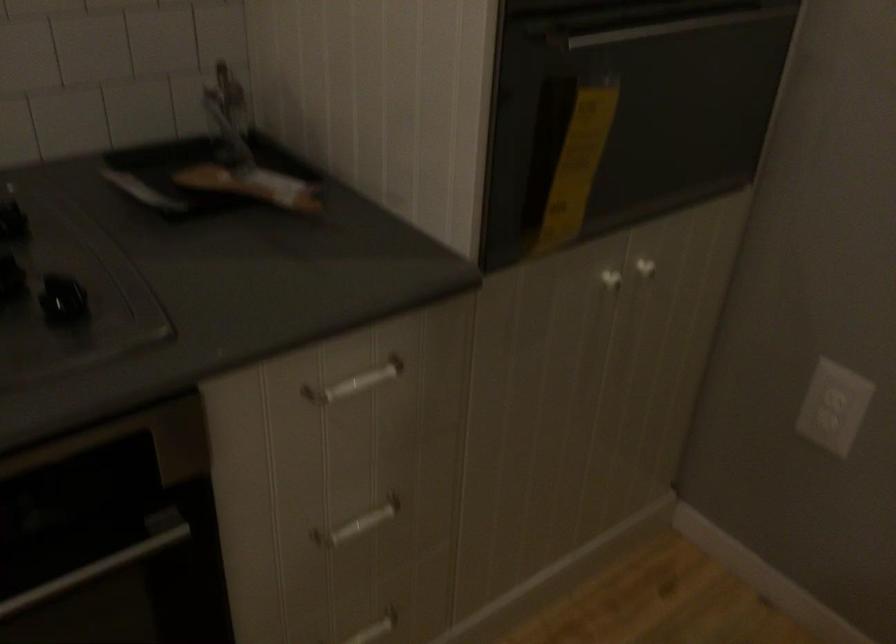
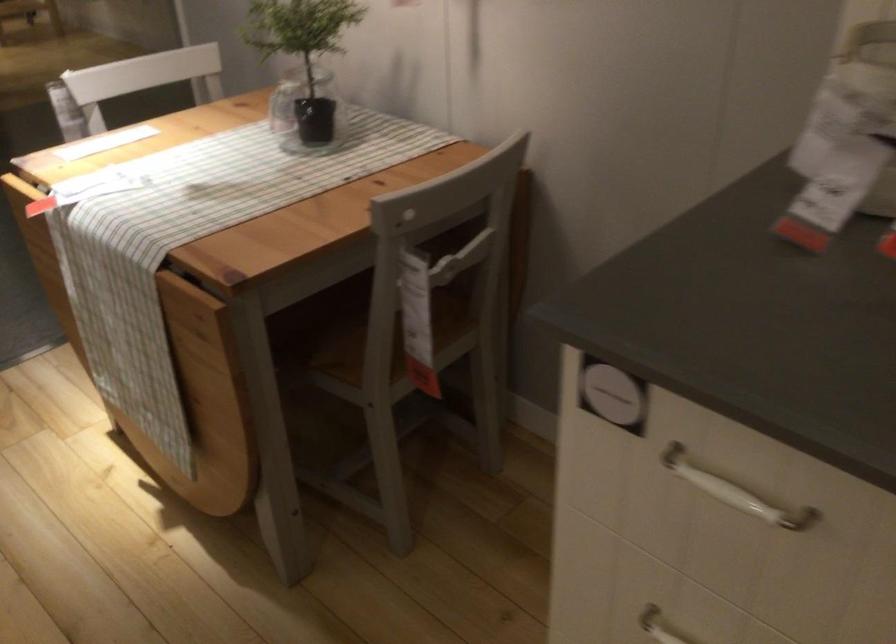
The first image is from the beginning of the video and the second image is from the end. How did the camera likely rotate when shooting the video?

The camera rotated toward left-down.